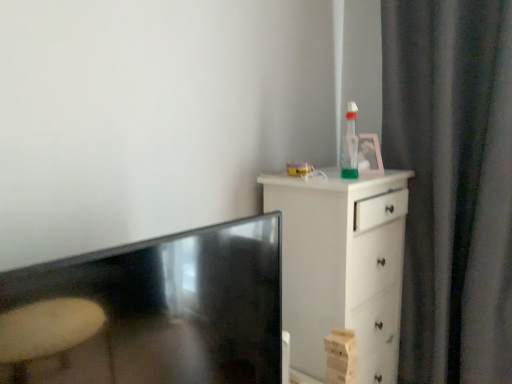
Question: Can you confirm if dark gray fabric curtain at right is positioned to the left of white wood chest of drawers at right?

Choices:
 (A) yes
 (B) no

Answer: (B)

Question: Can you confirm if dark gray fabric curtain at right is wider than white wood chest of drawers at right?

Choices:
 (A) no
 (B) yes

Answer: (A)

Question: Is dark gray fabric curtain at right positioned far away from white wood chest of drawers at right?

Choices:
 (A) no
 (B) yes

Answer: (A)

Question: Can you confirm if dark gray fabric curtain at right is smaller than white wood chest of drawers at right?

Choices:
 (A) yes
 (B) no

Answer: (A)

Question: Is dark gray fabric curtain at right touching white wood chest of drawers at right?

Choices:
 (A) no
 (B) yes

Answer: (A)

Question: Is white wood chest of drawers at right in front of or behind translucent green bottle at upper right in the image?

Choices:
 (A) front
 (B) behind

Answer: (A)

Question: Is point (402, 231) positioned closer to the camera than point (348, 147)?

Choices:
 (A) closer
 (B) farther

Answer: (B)

Question: Considering the positions of white wood chest of drawers at right and translucent green bottle at upper right in the image, is white wood chest of drawers at right wider or thinner than translucent green bottle at upper right?

Choices:
 (A) thin
 (B) wide

Answer: (B)

Question: Is white wood chest of drawers at right taller or shorter than translucent green bottle at upper right?

Choices:
 (A) tall
 (B) short

Answer: (A)

Question: Visually, is matte black tv at lower left positioned to the left or to the right of dark gray fabric curtain at right?

Choices:
 (A) left
 (B) right

Answer: (A)

Question: Is matte black tv at lower left in front of or behind dark gray fabric curtain at right in the image?

Choices:
 (A) front
 (B) behind

Answer: (A)

Question: In terms of width, does matte black tv at lower left look wider or thinner when compared to dark gray fabric curtain at right?

Choices:
 (A) thin
 (B) wide

Answer: (B)

Question: In terms of height, does matte black tv at lower left look taller or shorter compared to dark gray fabric curtain at right?

Choices:
 (A) tall
 (B) short

Answer: (B)

Question: From the image's perspective, is white wood chest of drawers at right located above or below dark gray fabric curtain at right?

Choices:
 (A) below
 (B) above

Answer: (A)

Question: From a real-world perspective, relative to dark gray fabric curtain at right, is white wood chest of drawers at right vertically above or below?

Choices:
 (A) below
 (B) above

Answer: (A)